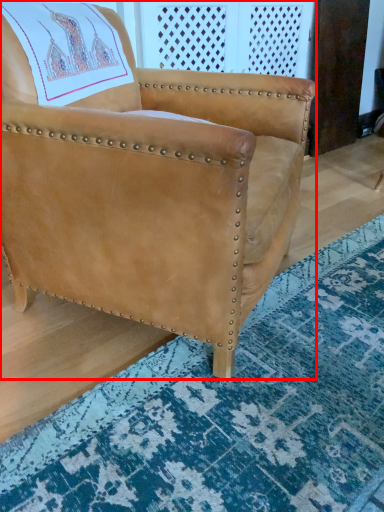
Question: Observing the image, what is the correct spatial positioning of chair (annotated by the red box) in reference to mat?

Choices:
 (A) left
 (B) right

Answer: (A)